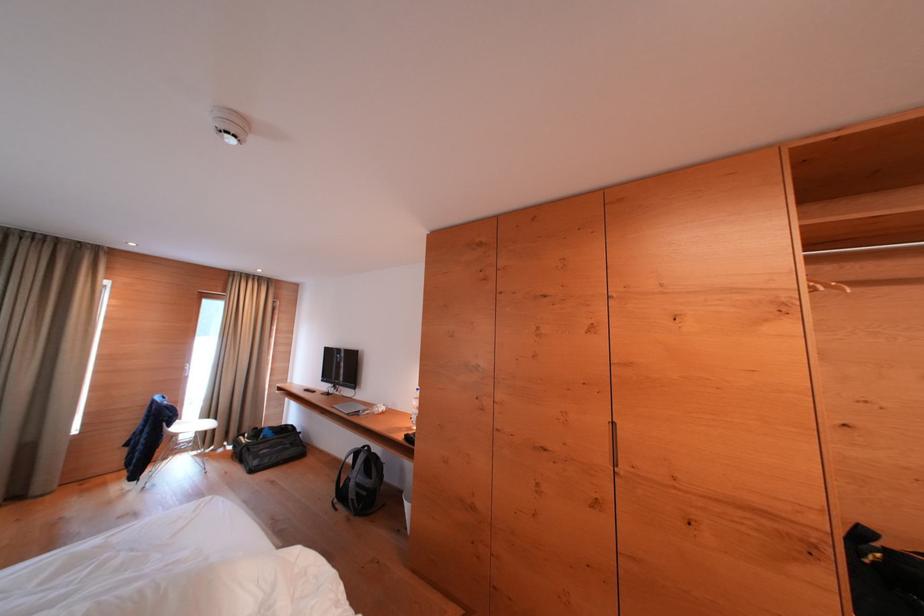
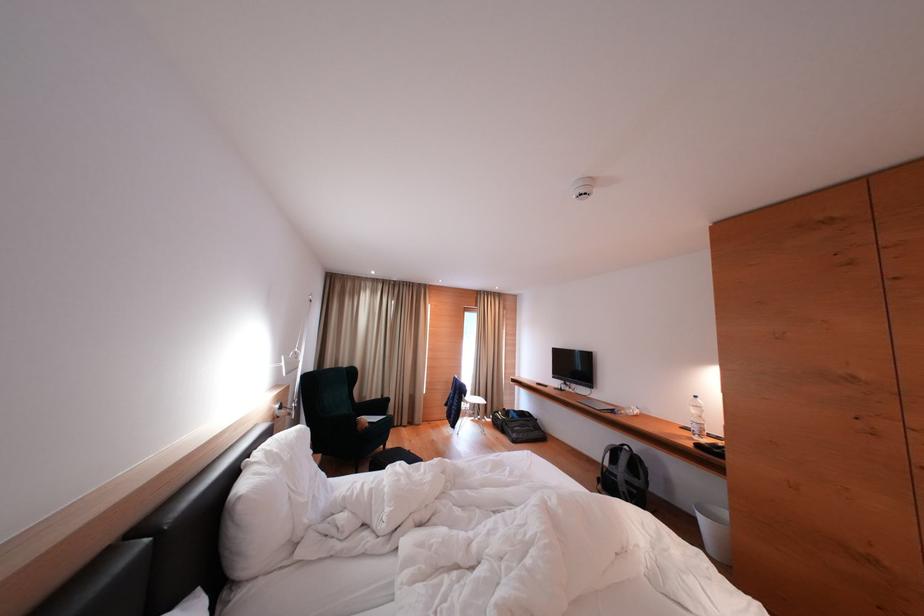
Find the pixel in the second image that matches [367,450] in the first image.

(624, 448)